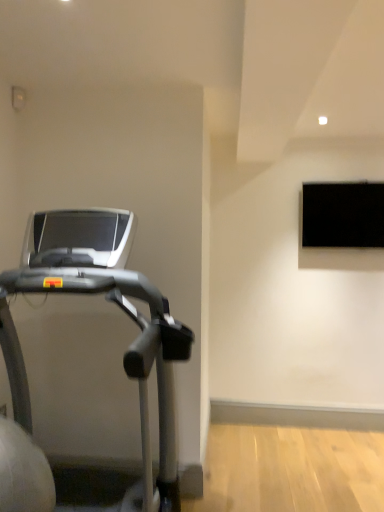
Question: From the image's perspective, is silver metallic treadmill at left on black matte tv at upper right?

Choices:
 (A) no
 (B) yes

Answer: (A)

Question: Is black matte tv at upper right inside silver metallic treadmill at left?

Choices:
 (A) no
 (B) yes

Answer: (A)

Question: Is the surface of silver metallic treadmill at left in direct contact with black matte tv at upper right?

Choices:
 (A) yes
 (B) no

Answer: (B)

Question: Is silver metallic treadmill at left at the right side of black matte tv at upper right?

Choices:
 (A) no
 (B) yes

Answer: (A)

Question: Considering the relative sizes of silver metallic treadmill at left and black matte tv at upper right in the image provided, is silver metallic treadmill at left thinner than black matte tv at upper right?

Choices:
 (A) yes
 (B) no

Answer: (B)

Question: Considering the relative sizes of silver metallic treadmill at left and black matte tv at upper right in the image provided, is silver metallic treadmill at left shorter than black matte tv at upper right?

Choices:
 (A) no
 (B) yes

Answer: (A)

Question: From a real-world perspective, does black matte tv at upper right stand above silver metallic treadmill at left?

Choices:
 (A) yes
 (B) no

Answer: (A)

Question: Is black matte tv at upper right in front of silver metallic treadmill at left?

Choices:
 (A) no
 (B) yes

Answer: (A)

Question: Would you say black matte tv at upper right is a long distance from silver metallic treadmill at left?

Choices:
 (A) no
 (B) yes

Answer: (B)

Question: Is black matte tv at upper right aimed at silver metallic treadmill at left?

Choices:
 (A) no
 (B) yes

Answer: (A)

Question: Does black matte tv at upper right appear on the left side of silver metallic treadmill at left?

Choices:
 (A) yes
 (B) no

Answer: (B)

Question: From the image's perspective, is black matte tv at upper right over silver metallic treadmill at left?

Choices:
 (A) no
 (B) yes

Answer: (B)

Question: Is black matte tv at upper right wider or thinner than silver metallic treadmill at left?

Choices:
 (A) thin
 (B) wide

Answer: (A)